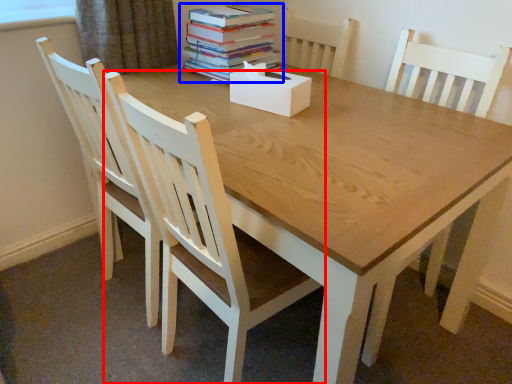
Question: Among these objects, which one is farthest to the camera, chair (highlighted by a red box) or book (highlighted by a blue box)?

Choices:
 (A) chair
 (B) book

Answer: (B)